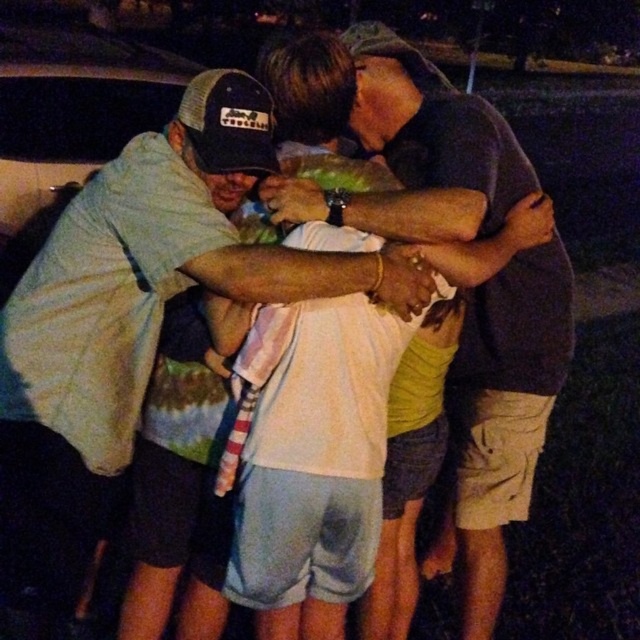
Looking at this image, you are a photographer trying to capture a group photo of the light blue shirt at center and dark gray shirt at center. Since you want to ensure both subjects are fully visible, which subject should you position closer to the camera to avoid cropping?

The light blue shirt at center should be positioned closer to the camera because its width surpasses that of the dark gray shirt at center, ensuring it fits within the frame without being cropped.

You are standing in a dimly lit park at night. You see two people in the center of the image wearing a light blue shirt at center and a dark gray shirt at center. Which one is positioned to the left?

The light blue shirt at center is positioned to the left of the dark gray shirt at center.

You are standing at the origin point in the image. Which of the two points, point (156, 284) or point (448, 172), is closer to you?

Point (156, 284) is closer to you because it is in front of point (448, 172).